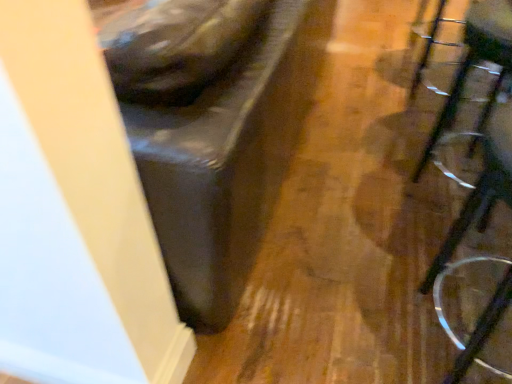
Question: Considering the relative sizes of clear plastic swivel chair at right and clear plastic glasses at right in the image provided, is clear plastic swivel chair at right shorter than clear plastic glasses at right?

Choices:
 (A) no
 (B) yes

Answer: (B)

Question: Is clear plastic swivel chair at right bigger than clear plastic glasses at right?

Choices:
 (A) yes
 (B) no

Answer: (B)

Question: Is clear plastic swivel chair at right smaller than clear plastic glasses at right?

Choices:
 (A) no
 (B) yes

Answer: (B)

Question: From the image's perspective, is clear plastic swivel chair at right under clear plastic glasses at right?

Choices:
 (A) no
 (B) yes

Answer: (A)

Question: Is clear plastic swivel chair at right facing towards clear plastic glasses at right?

Choices:
 (A) no
 (B) yes

Answer: (A)

Question: Is clear plastic swivel chair at right next to clear plastic glasses at right?

Choices:
 (A) yes
 (B) no

Answer: (B)

Question: Can you confirm if clear plastic glasses at right is shorter than clear plastic swivel chair at right?

Choices:
 (A) yes
 (B) no

Answer: (B)

Question: Does clear plastic glasses at right touch clear plastic swivel chair at right?

Choices:
 (A) no
 (B) yes

Answer: (A)

Question: From a real-world perspective, is clear plastic glasses at right physically below clear plastic swivel chair at right?

Choices:
 (A) yes
 (B) no

Answer: (B)

Question: From a real-world perspective, is clear plastic glasses at right on top of clear plastic swivel chair at right?

Choices:
 (A) yes
 (B) no

Answer: (A)

Question: Considering the relative sizes of clear plastic glasses at right and clear plastic swivel chair at right in the image provided, is clear plastic glasses at right bigger than clear plastic swivel chair at right?

Choices:
 (A) yes
 (B) no

Answer: (A)

Question: Is clear plastic glasses at right to the left of clear plastic swivel chair at right from the viewer's perspective?

Choices:
 (A) yes
 (B) no

Answer: (A)

Question: From the image's perspective, is clear plastic glasses at right located above or below clear plastic swivel chair at right?

Choices:
 (A) below
 (B) above

Answer: (A)